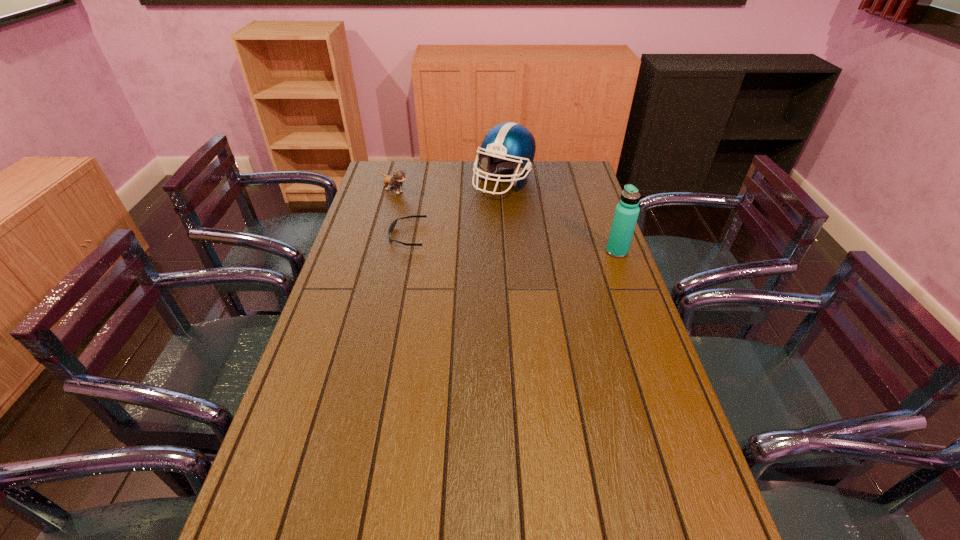
The height and width of the screenshot is (540, 960). Identify the location of vacant space located 0.090m at the front of the football helmet with the faceguard. (516, 215).

This screenshot has width=960, height=540. In order to click on free point located 0.160m at the front of the football helmet with the faceguard in this screenshot , I will do `click(520, 226)`.

This screenshot has width=960, height=540. What are the coordinates of `kitten located in the far edge section of the desktop` in the screenshot? It's located at (395, 181).

At what (x,y) coordinates should I click in order to perform the action: click on football helmet positioned at the far edge. Please return your answer as a coordinate pair (x, y). Looking at the image, I should click on (507, 145).

Where is `sunglasses that is at the left edge`? sunglasses that is at the left edge is located at coordinates (393, 224).

You are a GUI agent. You are given a task and a screenshot of the screen. Output one action in this format:
    pyautogui.click(x=<x>, y=<y>)
    Task: Click on the kitten that is at the left edge
    Image resolution: width=960 pixels, height=540 pixels.
    Given the screenshot: What is the action you would take?
    pyautogui.click(x=395, y=181)

At what (x,y) coordinates should I click in order to perform the action: click on object positioned at the right edge. Please return your answer as a coordinate pair (x, y). The image size is (960, 540). Looking at the image, I should click on (627, 211).

In order to click on object present at the far left corner in this screenshot , I will do `click(395, 181)`.

Where is `blank space at the near edge`? blank space at the near edge is located at coordinates (457, 514).

Where is `vacant region at the left edge of the desktop`? This screenshot has height=540, width=960. vacant region at the left edge of the desktop is located at coordinates (367, 330).